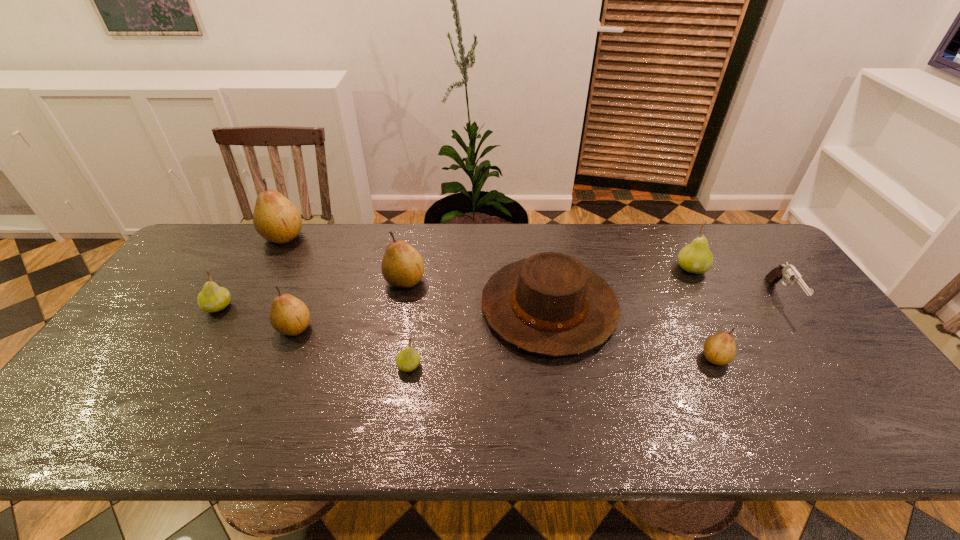
The image size is (960, 540). In order to click on the third pear from left to right in this screenshot , I will do `click(290, 316)`.

Where is `gun`? Image resolution: width=960 pixels, height=540 pixels. gun is located at coordinates (789, 272).

What are the coordinates of `the second green pear from right to left` in the screenshot? It's located at (408, 359).

This screenshot has width=960, height=540. I want to click on the nearest green pear, so click(408, 359).

The height and width of the screenshot is (540, 960). I want to click on the rightmost brown pear, so click(x=720, y=349).

The height and width of the screenshot is (540, 960). Identify the location of the nearest brown pear. (720, 349).

You are a GUI agent. You are given a task and a screenshot of the screen. Output one action in this format:
    pyautogui.click(x=<x>, y=<y>)
    Task: Click on the vacant space located 0.310m on the right of the farthest object
    This screenshot has width=960, height=540.
    Given the screenshot: What is the action you would take?
    pyautogui.click(x=396, y=237)

Find the location of a particular element. This screenshot has width=960, height=540. vacant space positioned 0.140m on the left of the rightmost green pear is located at coordinates (631, 268).

Locate an element on the screen. The width and height of the screenshot is (960, 540). vacant space positioned on the front of the third brown pear from left to right is located at coordinates 387,380.

Locate an element on the screen. The width and height of the screenshot is (960, 540). free spot located on the front of the cowboy hat is located at coordinates (567, 424).